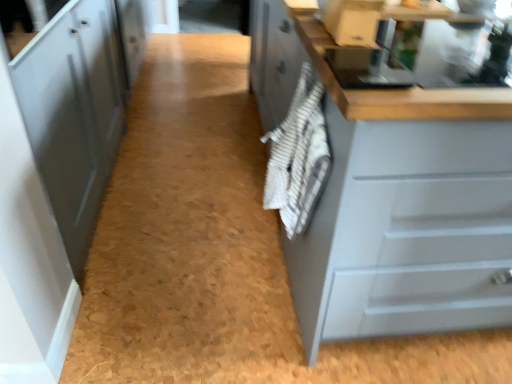
Locate an element on the screen. free location to the left of matte gray cabinet at right, positioned as the first cabinetry in right-to-left order is located at coordinates (205, 280).